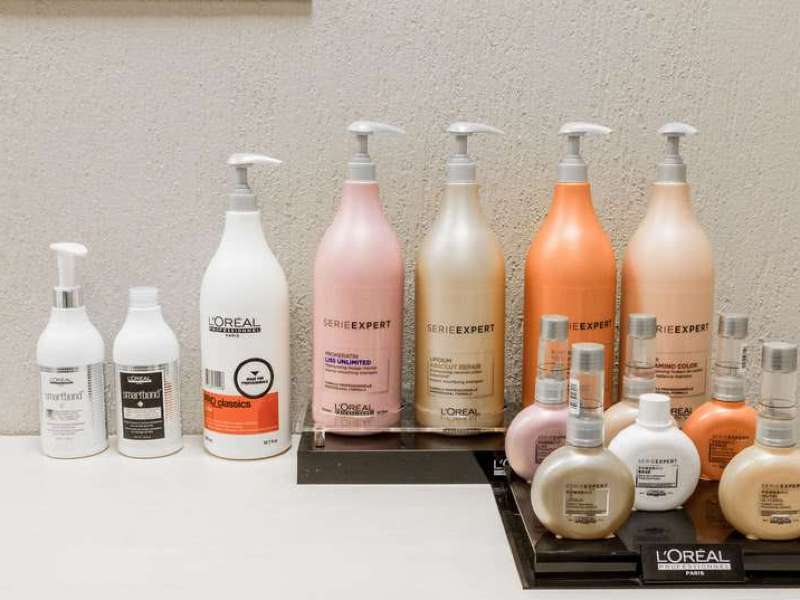
What are the coordinates of `tall pump dispensers` in the screenshot? It's located at (670, 244), (578, 244), (466, 249), (361, 261), (250, 273).